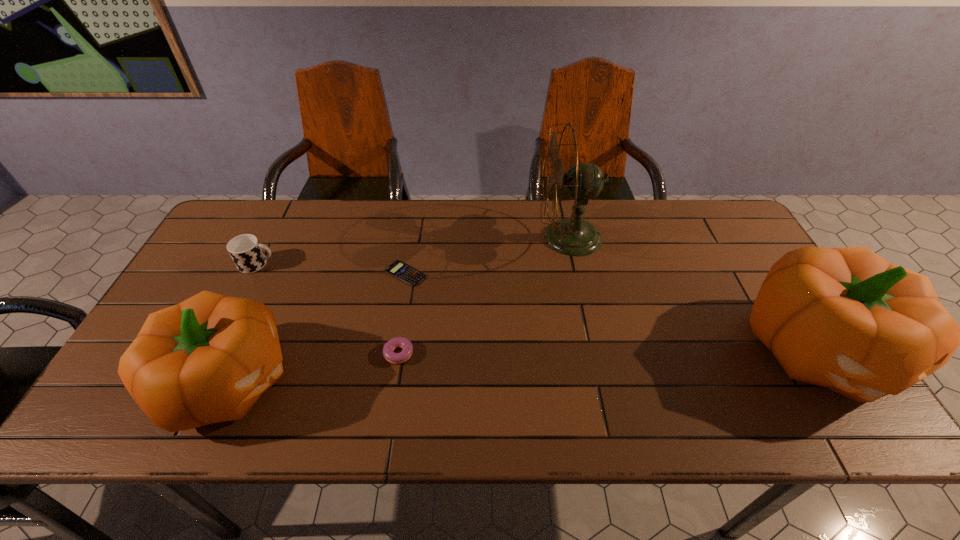
This screenshot has height=540, width=960. I want to click on empty space between the cup and the shortest object, so click(x=331, y=268).

At what (x,y) coordinates should I click in order to perform the action: click on empty space between the rightmost object and the cup. Please return your answer as a coordinate pair (x, y). Looking at the image, I should click on (538, 307).

You are a GUI agent. You are given a task and a screenshot of the screen. Output one action in this format:
    pyautogui.click(x=<x>, y=<y>)
    Task: Click on the empty location between the doughnut and the cup
    This screenshot has width=960, height=540.
    Given the screenshot: What is the action you would take?
    pyautogui.click(x=326, y=309)

This screenshot has width=960, height=540. In order to click on vacant space that's between the shortest object and the doughnut in this screenshot , I will do `click(400, 313)`.

Find the location of a particular element. The height and width of the screenshot is (540, 960). unoccupied area between the fifth object from left to right and the calculator is located at coordinates (488, 255).

Locate an element on the screen. object that is the fourth closest to the doughnut is located at coordinates (573, 236).

Identify the location of object that is the fourth nearest to the third tallest object. This screenshot has width=960, height=540. (573, 236).

The width and height of the screenshot is (960, 540). I want to click on blank space that satisfies the following two spatial constraints: 1. on the carved face of the rightmost object; 2. on the carved face of the shorter pumpkin, so click(x=838, y=381).

The height and width of the screenshot is (540, 960). In order to click on free space that satisfies the following two spatial constraints: 1. on the side of the fourth tallest object with the handle; 2. on the back side of the shortest object in this screenshot , I will do `click(252, 273)`.